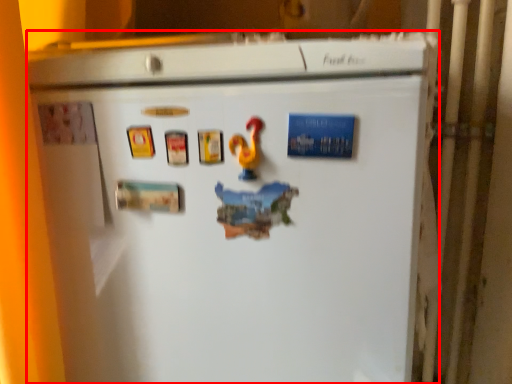
Question: From the image's perspective, where is refrigerator (annotated by the red box) located in relation to toy in the image?

Choices:
 (A) above
 (B) below

Answer: (B)